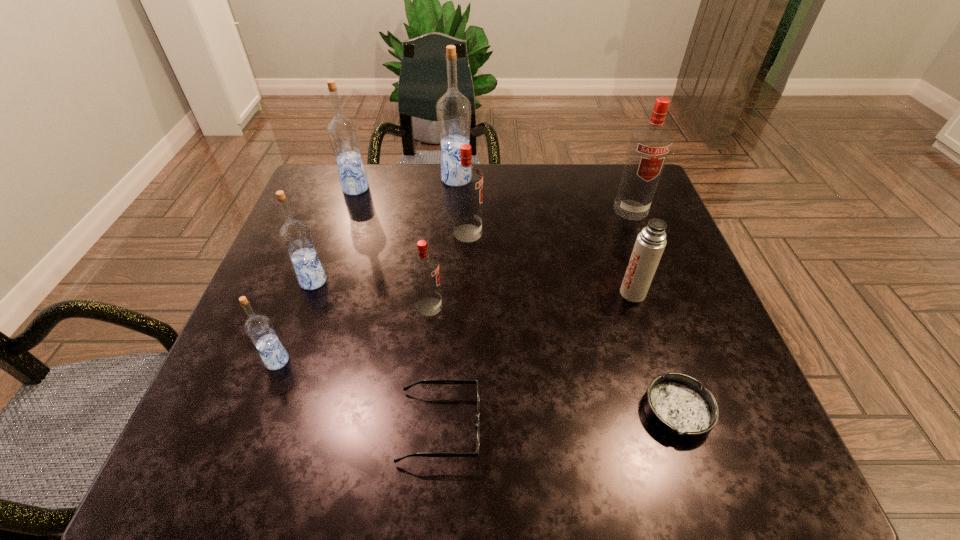
The width and height of the screenshot is (960, 540). I want to click on vacant space that satisfies the following two spatial constraints: 1. on the front label of the seventh nearest object; 2. on the right side of the dark ashtray, so click(463, 411).